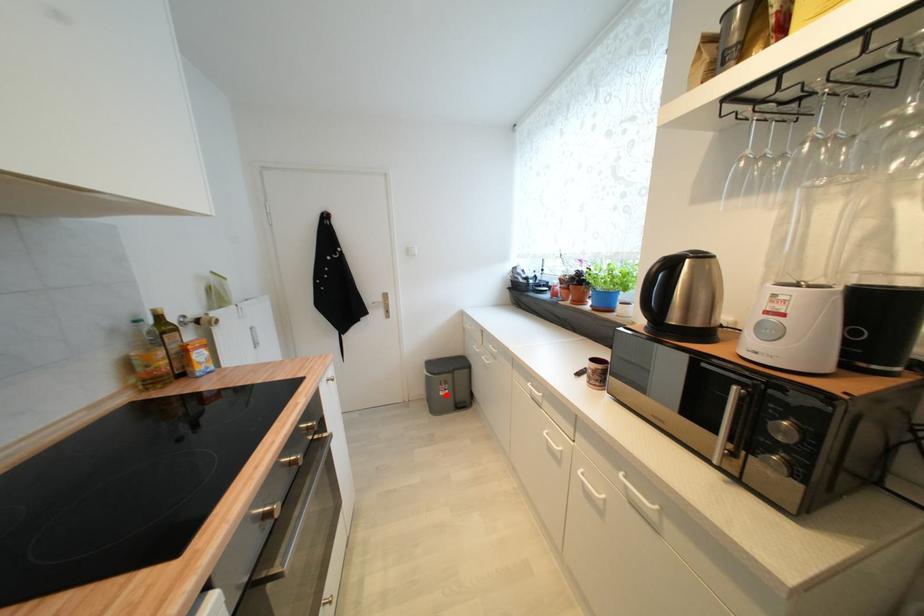
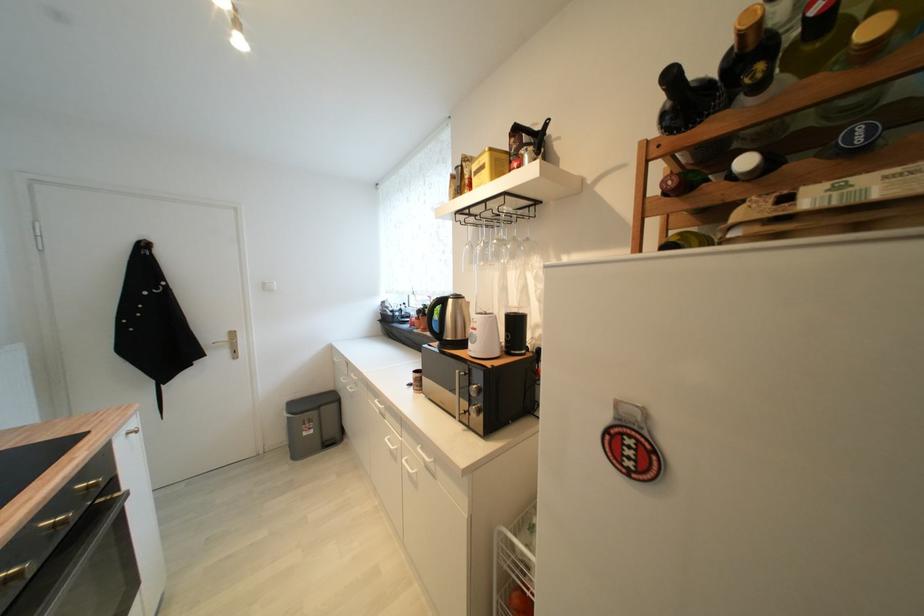
In the second image, find the point that corresponds to the highlighted location in the first image.

(310, 436)